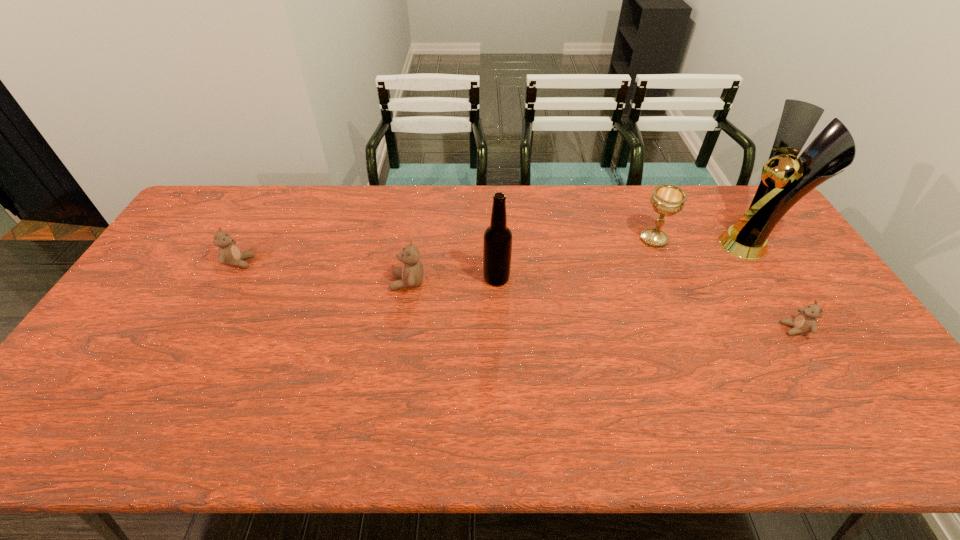
Please mark a free spot for a new teddy_bear to balance the arrangement. Please provide its 2D coordinates. Your answer should be formatted as a tuple, i.e. [(x, y)], where the tuple contains the x and y coordinates of a point satisfying the conditions above.

[(591, 305)]